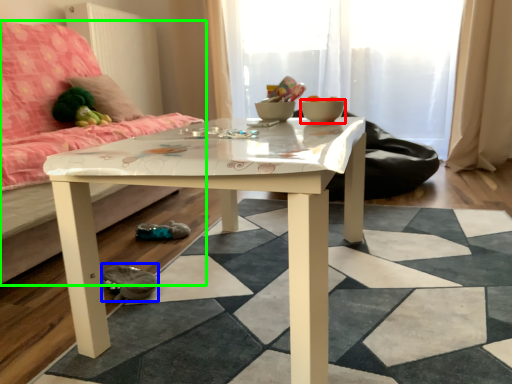
Question: Estimate the real-world distances between objects in this image. Which object is closer to bowl (highlighted by a red box), shoe (highlighted by a blue box) or studio couch (highlighted by a green box)?

Choices:
 (A) shoe
 (B) studio couch

Answer: (A)